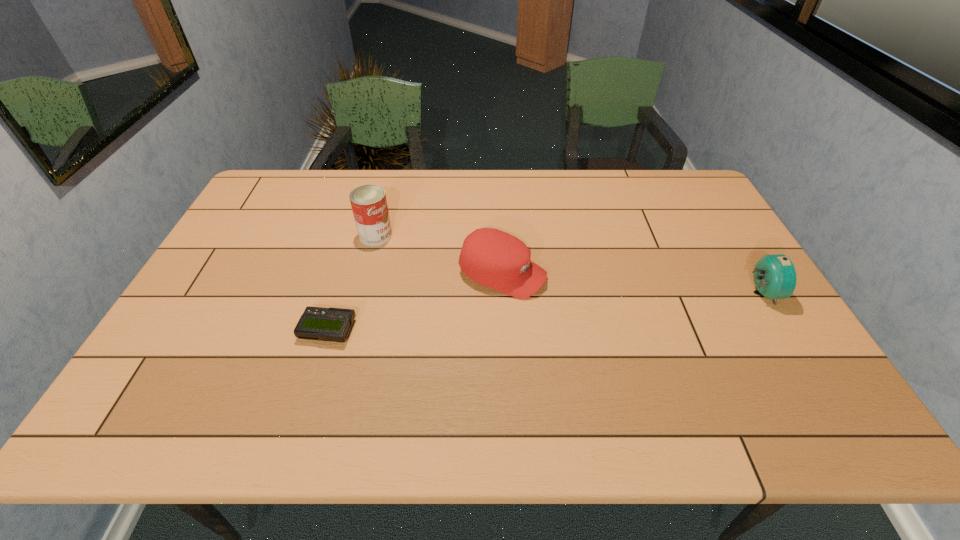
Locate an element on the screen. Image resolution: width=960 pixels, height=540 pixels. vacant region between the cap and the farthest object is located at coordinates (439, 255).

Identify the location of empty location between the beeper and the alarm clock. (544, 312).

Where is `free point between the farthest object and the third object from left to right`? free point between the farthest object and the third object from left to right is located at coordinates (439, 255).

Find the location of `vacant space in between the shortest object and the rightmost object`. vacant space in between the shortest object and the rightmost object is located at coordinates (544, 312).

Locate an element on the screen. This screenshot has width=960, height=540. empty location between the rightmost object and the farthest object is located at coordinates (568, 264).

In order to click on vacant space that's between the shortest object and the cap in this screenshot , I will do `click(415, 302)`.

The width and height of the screenshot is (960, 540). I want to click on vacant area that lies between the alarm clock and the shortest object, so click(544, 312).

Where is `vacant point located between the rightmost object and the tallest object`? The width and height of the screenshot is (960, 540). vacant point located between the rightmost object and the tallest object is located at coordinates (568, 264).

Image resolution: width=960 pixels, height=540 pixels. Find the location of `free space between the can and the alarm clock`. free space between the can and the alarm clock is located at coordinates (568, 264).

Locate an element on the screen. This screenshot has width=960, height=540. object identified as the closest to the cap is located at coordinates (369, 205).